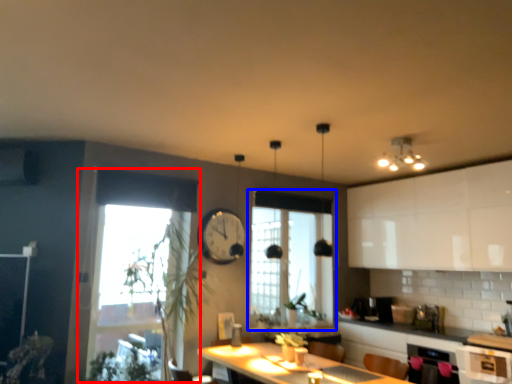
Question: Which point is closer to the camera, window (highlighted by a red box) or window (highlighted by a blue box)?

Choices:
 (A) window
 (B) window

Answer: (A)